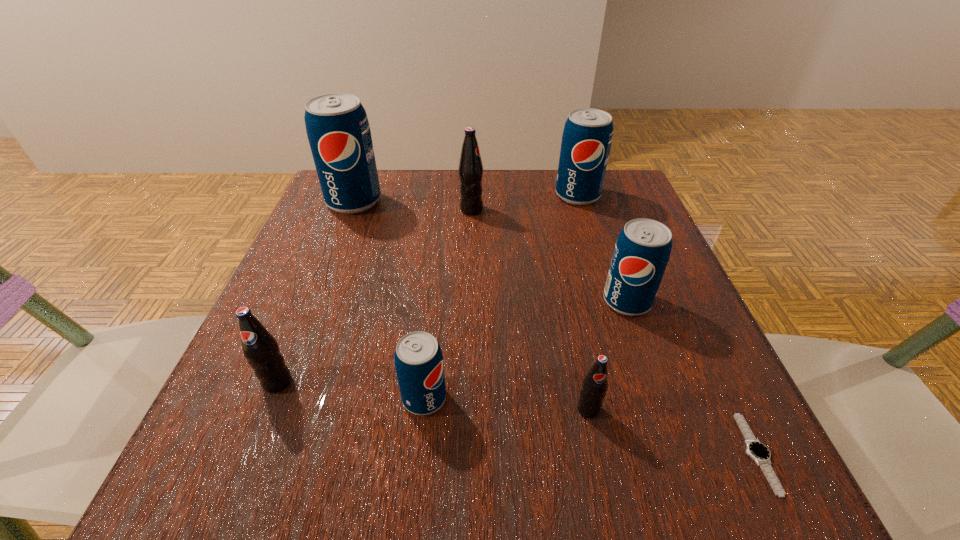
Where is `vacant region at the right edge`? This screenshot has height=540, width=960. vacant region at the right edge is located at coordinates (697, 344).

This screenshot has height=540, width=960. In the image, there is a desktop. Find the location of `vacant space at the near left corner`. vacant space at the near left corner is located at coordinates [184, 503].

In the image, there is a desktop. Where is `vacant space at the far right corner`? The height and width of the screenshot is (540, 960). vacant space at the far right corner is located at coordinates click(x=636, y=205).

At what (x,y) coordinates should I click in order to perform the action: click on free space between the leftmost black pop and the third biggest blue pop. Please return your answer as a coordinate pair (x, y). Looking at the image, I should click on (452, 342).

Locate an element on the screen. The image size is (960, 540). empty space between the third biggest blue pop and the third smallest blue pop is located at coordinates (602, 248).

Identify the location of vacant area between the fifth object from left to right and the nearest blue pop. (506, 403).

The height and width of the screenshot is (540, 960). I want to click on vacant area between the leftmost black pop and the third smallest blue pop, so click(427, 289).

I want to click on empty space between the second farthest black pop and the leftmost blue pop, so click(316, 292).

This screenshot has width=960, height=540. Identify the location of blank region between the third pop from right to left and the watch. (672, 431).

At what (x,y) coordinates should I click in order to perform the action: click on vacant space that is in between the tallest object and the fifth pop from left to right. Please return your answer as a coordinate pair (x, y). This screenshot has width=960, height=540. Looking at the image, I should click on (471, 305).